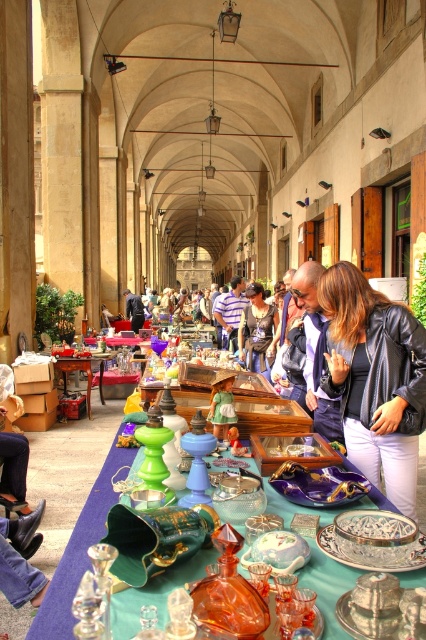
From the picture: You are a customer at the market and want to place a small package on the surface between the matte black jacket at center and the green glass table at center. Can you fit it there?

The matte black jacket at center is narrower than the green glass table at center, so there is space between them. Since the package is small, it should fit in the available space between the matte black jacket at center and the green glass table at center.

You are a customer at the market and want to reach the green glass table at center to examine its items. There is a brushed metal water at bottle left in your path. Which object should you move around to get to the table?

You should move around the brushed metal water at bottle left since the green glass table at center is positioned to its right side.